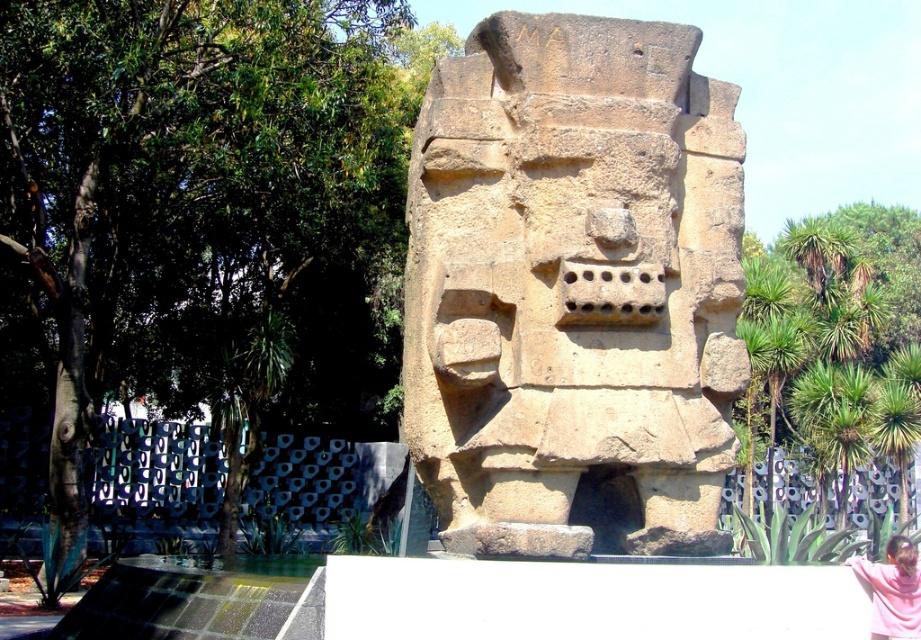
Question: Estimate the real-world distances between objects in this image. Which object is farther from the pink fabric at lower right?

Choices:
 (A) brown stone sculpture at center
 (B) matte brown statue at center

Answer: (A)

Question: In this image, where is brown stone sculpture at center located relative to matte brown statue at center?

Choices:
 (A) left
 (B) right

Answer: (A)

Question: Which point is farther to the camera?

Choices:
 (A) brown stone sculpture at center
 (B) matte brown statue at center
 (C) pink fabric at lower right

Answer: (B)

Question: Can you confirm if pink fabric at lower right is positioned to the left of matte brown statue at center?

Choices:
 (A) no
 (B) yes

Answer: (B)

Question: Which object is closer to the camera taking this photo?

Choices:
 (A) matte brown statue at center
 (B) brown stone sculpture at center
 (C) pink fabric at lower right

Answer: (C)

Question: In this image, where is pink fabric at lower right located relative to matte brown statue at center?

Choices:
 (A) above
 (B) below

Answer: (B)